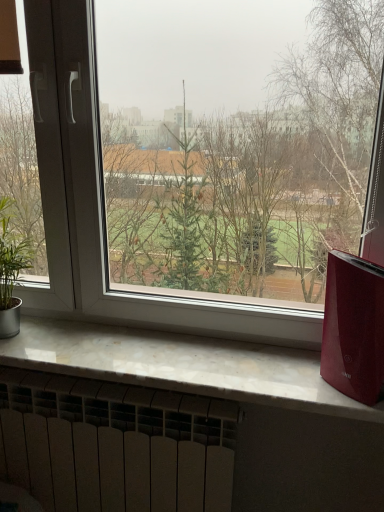
This screenshot has height=512, width=384. Find the location of `vacant space that's between transparent glass window at center and green leafy plant at left`. vacant space that's between transparent glass window at center and green leafy plant at left is located at coordinates (126, 355).